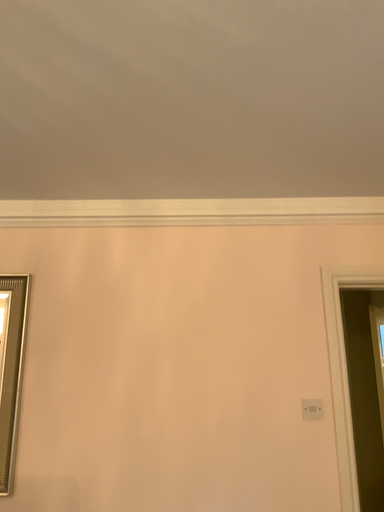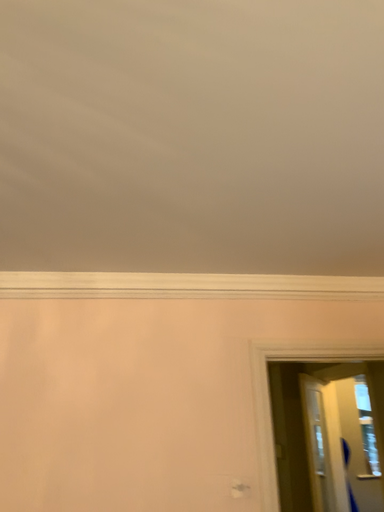
Question: Which way did the camera rotate in the video?

Choices:
 (A) rotated right
 (B) rotated left

Answer: (A)